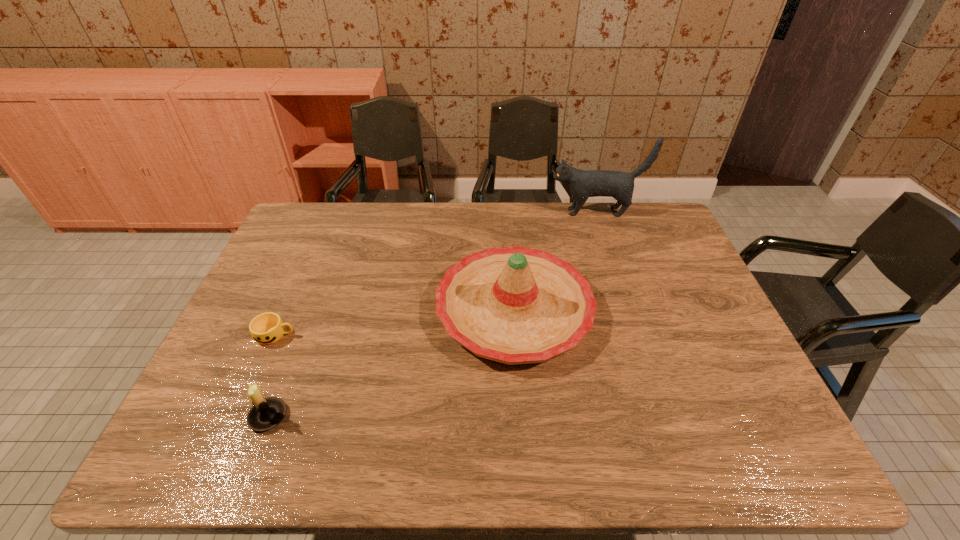
This screenshot has height=540, width=960. Find the location of `the farthest object`. the farthest object is located at coordinates (582, 184).

You are a GUI agent. You are given a task and a screenshot of the screen. Output one action in this format:
    pyautogui.click(x=<x>, y=<y>)
    Task: Click on the tallest object
    
    Given the screenshot: What is the action you would take?
    pyautogui.click(x=582, y=184)

Identify the location of sombrero. (515, 305).

Locate an element on the screen. The height and width of the screenshot is (540, 960). the second shortest object is located at coordinates (266, 413).

Where is `the nearest object`? Image resolution: width=960 pixels, height=540 pixels. the nearest object is located at coordinates (266, 413).

I want to click on cup, so (267, 328).

This screenshot has width=960, height=540. Find the location of `vacant area situated 0.350m at the face of the tallest object`. vacant area situated 0.350m at the face of the tallest object is located at coordinates (452, 212).

The width and height of the screenshot is (960, 540). I want to click on vacant region located at the face of the tallest object, so click(x=466, y=212).

Find the location of a particular element. blank space located 0.160m at the face of the tallest object is located at coordinates (505, 212).

This screenshot has height=540, width=960. What are the coordinates of `vacant space located 0.060m on the back of the sombrero` in the screenshot? It's located at (510, 247).